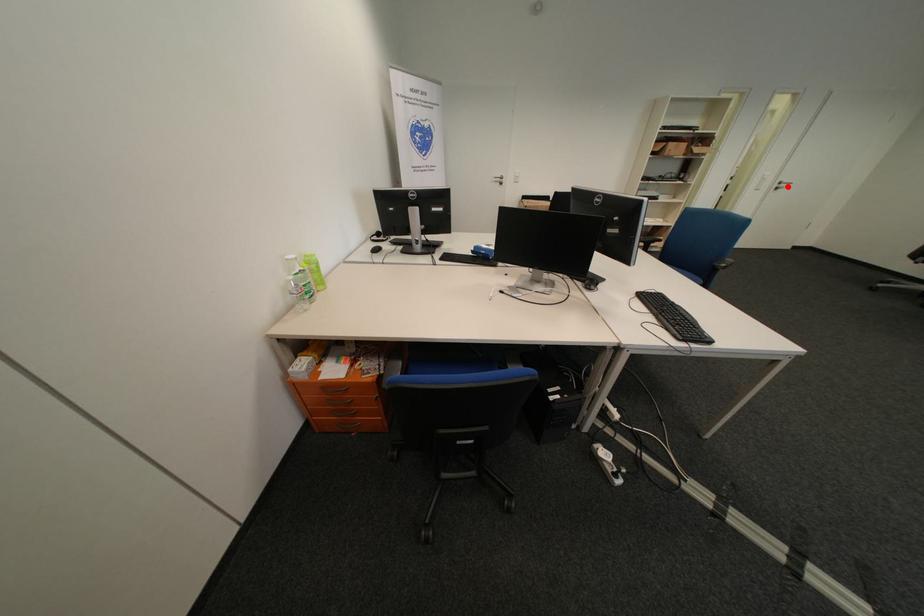
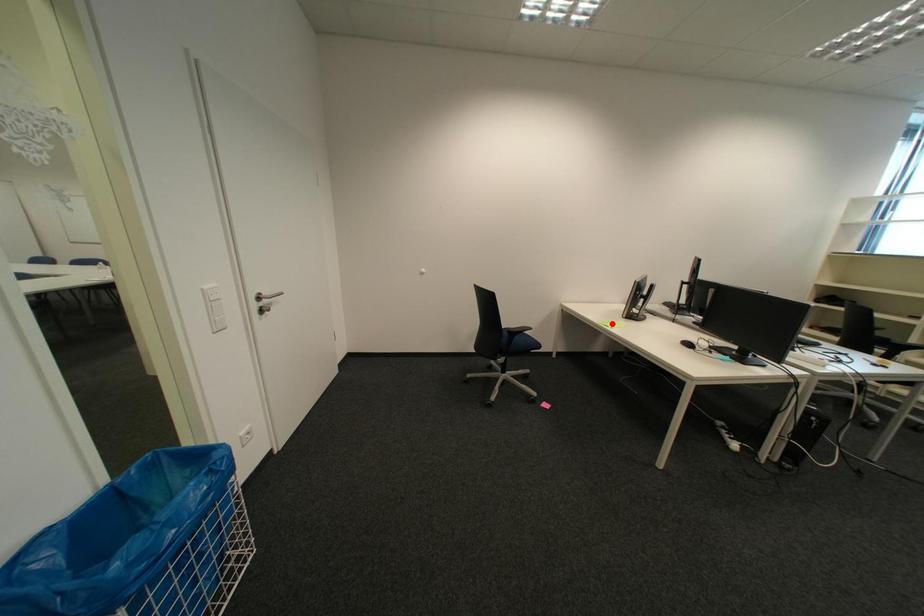
I am providing you with two images of the same scene from different viewpoints. A red point is marked on the first image and another point is marked on the second image. Is the marked point in image1 the same physical position as the marked point in image2?

No